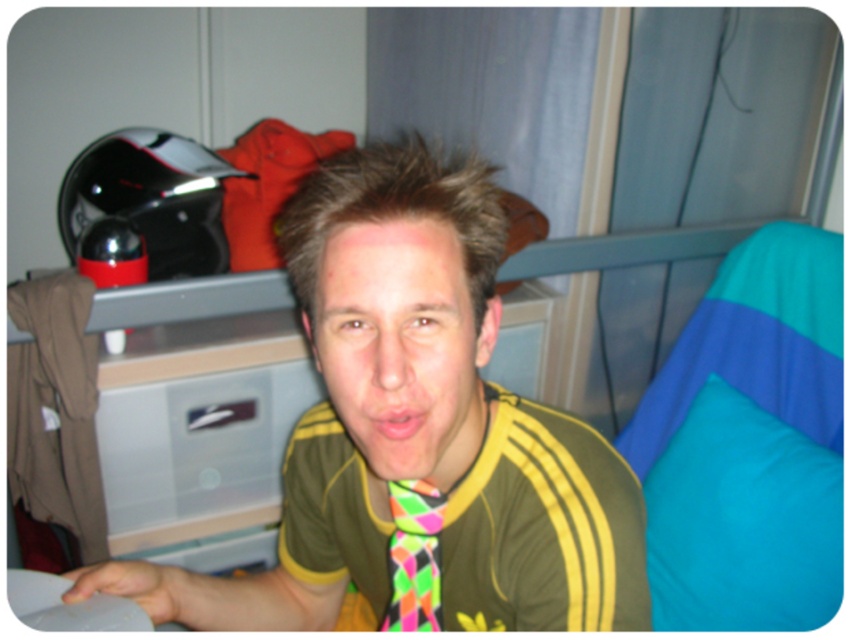
Between point (360, 275) and point (387, 410), which one is positioned behind?

Point (387, 410)

Does point (568, 588) lie in front of point (369, 417)?

That is False.

Identify the location of neon tie at center. The width and height of the screenshot is (852, 640). (417, 442).

Describe the element at coordinates (417, 442) in the screenshot. I see `neon tie at center` at that location.

Does point (337, 336) lie in front of point (237, 381)?

Yes, point (337, 336) is closer to viewer.

Which is behind, point (312, 481) or point (154, 396)?

The point (154, 396) is more distant.

This screenshot has height=640, width=852. Identify the location of neon tie at center. (417, 442).

Is neon tie at center thinner than neon multicolored fabric tie at center?

No, neon tie at center is not thinner than neon multicolored fabric tie at center.

Who is taller, neon tie at center or neon multicolored fabric tie at center?

neon tie at center

You are a GUI agent. You are given a task and a screenshot of the screen. Output one action in this format:
    pyautogui.click(x=<x>, y=<y>)
    Task: Click on the neon tie at center
    The height and width of the screenshot is (640, 852).
    Given the screenshot: What is the action you would take?
    pyautogui.click(x=417, y=442)

Identify the location of neon tie at center. (417, 442).